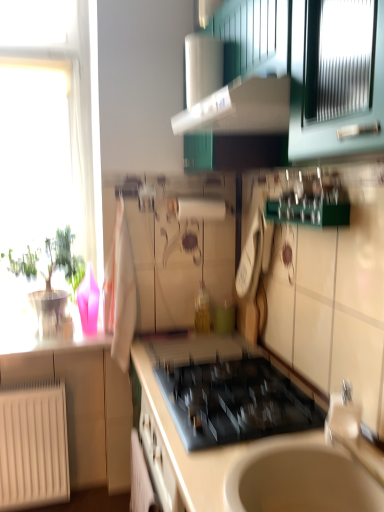
Question: Does white glossy countertop at center have a greater width compared to silver metallic faucet at lower right?

Choices:
 (A) yes
 (B) no

Answer: (A)

Question: Is white glossy countertop at center to the left of silver metallic faucet at lower right from the viewer's perspective?

Choices:
 (A) no
 (B) yes

Answer: (B)

Question: Can you confirm if white glossy countertop at center is positioned to the right of silver metallic faucet at lower right?

Choices:
 (A) no
 (B) yes

Answer: (A)

Question: Does white glossy countertop at center have a larger size compared to silver metallic faucet at lower right?

Choices:
 (A) yes
 (B) no

Answer: (A)

Question: Is white glossy countertop at center not within silver metallic faucet at lower right?

Choices:
 (A) yes
 (B) no

Answer: (A)

Question: Is white glossy countertop at center directly adjacent to silver metallic faucet at lower right?

Choices:
 (A) yes
 (B) no

Answer: (B)

Question: Does transparent glass window at left have a greater height compared to black glass gas stove at center?

Choices:
 (A) yes
 (B) no

Answer: (A)

Question: From the image's perspective, is transparent glass window at left below black glass gas stove at center?

Choices:
 (A) no
 (B) yes

Answer: (A)

Question: Would you say transparent glass window at left contains black glass gas stove at center?

Choices:
 (A) yes
 (B) no

Answer: (B)

Question: Considering the relative sizes of transparent glass window at left and black glass gas stove at center in the image provided, is transparent glass window at left smaller than black glass gas stove at center?

Choices:
 (A) no
 (B) yes

Answer: (A)

Question: Is transparent glass window at left aimed at black glass gas stove at center?

Choices:
 (A) yes
 (B) no

Answer: (B)

Question: Is transparent glass window at left completely or partially outside of black glass gas stove at center?

Choices:
 (A) yes
 (B) no

Answer: (A)

Question: From a real-world perspective, is silver metallic faucet at lower right over white matte radiator at lower left?

Choices:
 (A) no
 (B) yes

Answer: (B)